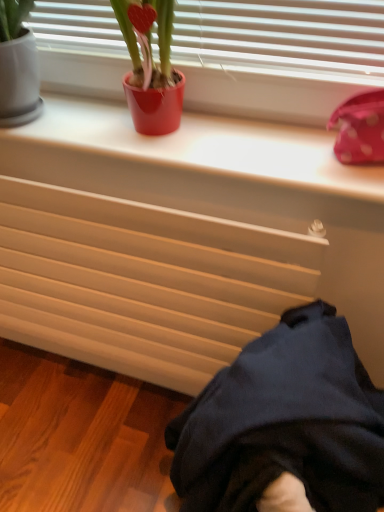
Question: Can you confirm if shiny red pot at upper center is positioned to the right of dark blue fabric at lower right?

Choices:
 (A) yes
 (B) no

Answer: (B)

Question: Is shiny red pot at upper center facing towards dark blue fabric at lower right?

Choices:
 (A) yes
 (B) no

Answer: (B)

Question: From a real-world perspective, is shiny red pot at upper center beneath dark blue fabric at lower right?

Choices:
 (A) yes
 (B) no

Answer: (B)

Question: Can you confirm if shiny red pot at upper center is shorter than dark blue fabric at lower right?

Choices:
 (A) yes
 (B) no

Answer: (A)

Question: Does shiny red pot at upper center have a smaller size compared to dark blue fabric at lower right?

Choices:
 (A) no
 (B) yes

Answer: (B)

Question: Considering the relative sizes of shiny red pot at upper center and dark blue fabric at lower right in the image provided, is shiny red pot at upper center thinner than dark blue fabric at lower right?

Choices:
 (A) yes
 (B) no

Answer: (A)

Question: Is matte beige radiator at lower center facing towards white smooth window sill at upper center?

Choices:
 (A) no
 (B) yes

Answer: (A)

Question: Does matte beige radiator at lower center have a smaller size compared to white smooth window sill at upper center?

Choices:
 (A) yes
 (B) no

Answer: (B)

Question: Can you confirm if matte beige radiator at lower center is bigger than white smooth window sill at upper center?

Choices:
 (A) yes
 (B) no

Answer: (A)

Question: Does matte beige radiator at lower center appear on the right side of white smooth window sill at upper center?

Choices:
 (A) no
 (B) yes

Answer: (A)

Question: Is matte beige radiator at lower center thinner than white smooth window sill at upper center?

Choices:
 (A) yes
 (B) no

Answer: (A)

Question: Does matte beige radiator at lower center have a greater height compared to white smooth window sill at upper center?

Choices:
 (A) yes
 (B) no

Answer: (A)

Question: Does white smooth window sill at upper center have a greater height compared to dark blue fabric at lower right?

Choices:
 (A) yes
 (B) no

Answer: (B)